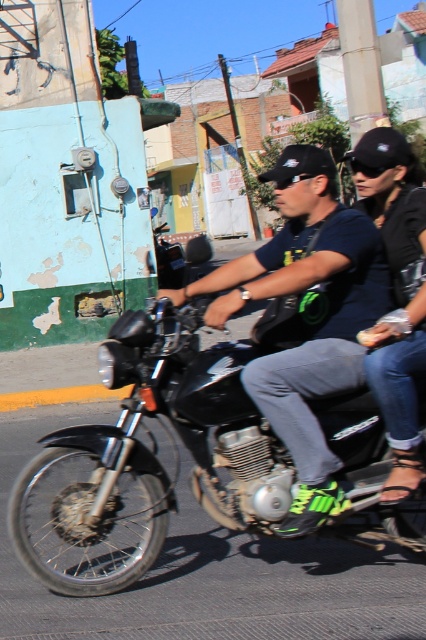
Can you confirm if black matte motorcycle at center is wider than matte black motorcycle at center?

Yes.

Between point (140, 348) and point (313, 458), which one is positioned behind?

Point (140, 348)

Identify the location of black matte motorcycle at center. The width and height of the screenshot is (426, 640). click(157, 451).